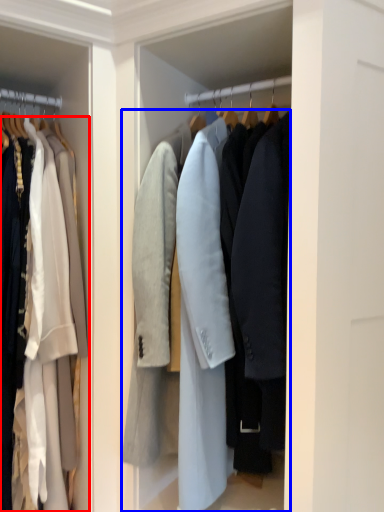
Question: Which object is closer to the camera taking this photo, coat (highlighted by a red box) or coat (highlighted by a blue box)?

Choices:
 (A) coat
 (B) coat

Answer: (B)